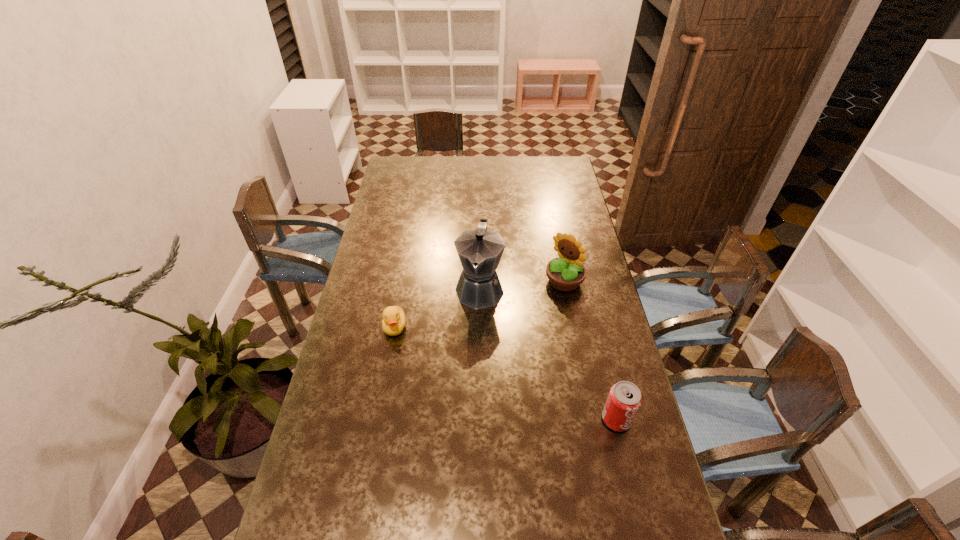
Find the location of `vacant region between the shortest object and the coffeepot`. vacant region between the shortest object and the coffeepot is located at coordinates (437, 308).

At what (x,y) coordinates should I click in order to perform the action: click on object that stands as the second closest to the shortest object. Please return your answer as a coordinate pair (x, y). This screenshot has height=540, width=960. Looking at the image, I should click on (565, 273).

Choose which object is the nearest neighbor to the soda can. Please provide its 2D coordinates. Your answer should be formatted as a tuple, i.e. [(x, y)], where the tuple contains the x and y coordinates of a point satisfying the conditions above.

[(480, 250)]

This screenshot has width=960, height=540. What are the coordinates of `vacant region that satisfies the following two spatial constraints: 1. on the face of the third tallest object; 2. on the left side of the leftmost object` in the screenshot? It's located at (378, 419).

Where is `free space that satisfies the following two spatial constraints: 1. on the front side of the second shortest object; 2. on the right side of the sunflower`? The height and width of the screenshot is (540, 960). free space that satisfies the following two spatial constraints: 1. on the front side of the second shortest object; 2. on the right side of the sunflower is located at coordinates (591, 419).

The height and width of the screenshot is (540, 960). Find the location of `vacant space that satisfies the following two spatial constraints: 1. on the front side of the third shortest object; 2. on the right side of the second shortest object`. vacant space that satisfies the following two spatial constraints: 1. on the front side of the third shortest object; 2. on the right side of the second shortest object is located at coordinates (591, 419).

Locate an element on the screen. This screenshot has width=960, height=540. free space that satisfies the following two spatial constraints: 1. on the front side of the soda can; 2. on the left side of the sunflower is located at coordinates (591, 419).